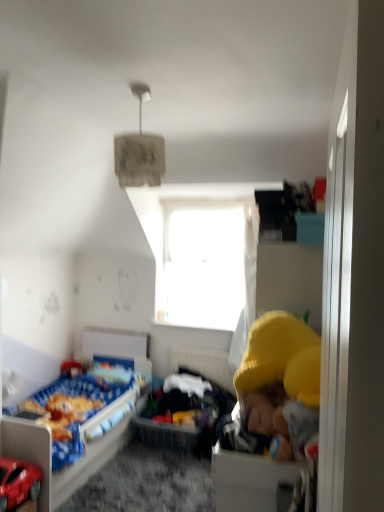
Question: From a real-world perspective, relative to textured paper lampshade at upper center, is blue fabric bed at lower left vertically above or below?

Choices:
 (A) above
 (B) below

Answer: (B)

Question: Does point (87, 340) appear closer or farther from the camera than point (145, 139)?

Choices:
 (A) farther
 (B) closer

Answer: (A)

Question: Estimate the real-world distances between objects in this image. Which object is closer to the textured paper lampshade at upper center?

Choices:
 (A) shiny red car at lower left
 (B) soft fabric basket at center
 (C) transparent glass window at center
 (D) blue fabric bed at lower left
 (E) white plastic drawer at lower right

Answer: (E)

Question: Which of these objects is positioned farthest from the shiny red car at lower left?

Choices:
 (A) blue fabric bed at lower left
 (B) soft fabric basket at center
 (C) white plastic drawer at lower right
 (D) transparent glass window at center
 (E) textured paper lampshade at upper center

Answer: (D)